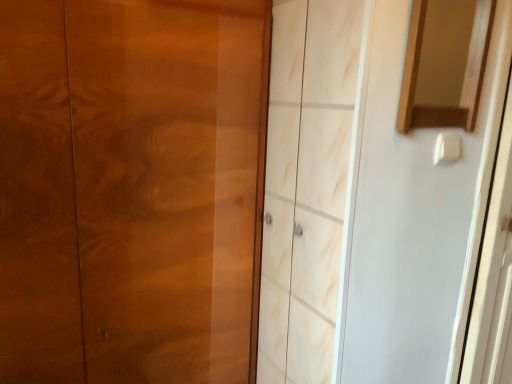
The image size is (512, 384). Describe the element at coordinates (463, 78) in the screenshot. I see `wooden mirror at upper right` at that location.

Measure the distance between wooden mirror at upper right and camera.

88.15 centimeters.

In order to face glossy wood door at left, should I rotate leftwards or rightwards?

It's best to rotate left around 15.903 degrees.

Find the location of a particular element. glossy wood door at left is located at coordinates (129, 189).

Where is `wooden mirror at upper right`? wooden mirror at upper right is located at coordinates (463, 78).

Locate an element on the screen. The width and height of the screenshot is (512, 384). screen door that is behind the wooden mirror at upper right is located at coordinates point(493,271).

Is white glossy screen door at right not near wooden mirror at upper right?

No.

Which is behind, point (481, 315) or point (411, 60)?

The point (481, 315) is farther.

Choose the correct answer: Is white glossy screen door at right inside wooden mirror at upper right or outside it?

The correct answer is: outside.

What's the angular difference between wooden mirror at upper right and white glossy screen door at right's facing directions?

They differ by 1.94 degrees in their facing directions.

Are wooden mirror at upper right and white glossy screen door at right beside each other?

No, wooden mirror at upper right is not making contact with white glossy screen door at right.

Considering the relative sizes of wooden mirror at upper right and white glossy screen door at right in the image provided, is wooden mirror at upper right smaller than white glossy screen door at right?

Indeed, wooden mirror at upper right has a smaller size compared to white glossy screen door at right.

Is wooden mirror at upper right outside of white glossy screen door at right?

wooden mirror at upper right lies outside white glossy screen door at right's area.

Considering the points (21, 335) and (408, 91), which point is behind, point (21, 335) or point (408, 91)?

The point (21, 335) is farther.

From a real-world perspective, between glossy wood door at left and wooden mirror at upper right, who is vertically lower?

In real-world perspective, glossy wood door at left is lower.

From the image's perspective, which object appears higher, glossy wood door at left or wooden mirror at upper right?

From the image's view, wooden mirror at upper right is above.

From the image's perspective, is white glossy screen door at right below glossy wood door at left?

Yes, from the image's perspective, white glossy screen door at right is beneath glossy wood door at left.

Considering the positions of objects white glossy screen door at right and glossy wood door at left in the image provided, who is in front, white glossy screen door at right or glossy wood door at left?

glossy wood door at left.

Are white glossy screen door at right and glossy wood door at left far apart?

That's not correct — white glossy screen door at right is a little close to glossy wood door at left.

Is white glossy screen door at right bigger than glossy wood door at left?

Incorrect, white glossy screen door at right is not larger than glossy wood door at left.

Looking at this image, do you think wooden mirror at upper right is within glossy wood door at left, or outside of it?

The correct answer is: outside.

Between wooden mirror at upper right and glossy wood door at left, which one has smaller width?

With smaller width is wooden mirror at upper right.

Is wooden mirror at upper right far from glossy wood door at left?

No, wooden mirror at upper right is not far away from glossy wood door at left.

Who is smaller, wooden mirror at upper right or glossy wood door at left?

wooden mirror at upper right.

Between glossy wood door at left and white glossy screen door at right, which one is positioned in front?

glossy wood door at left is in front.

Considering the positions of points (12, 63) and (494, 235), is point (12, 63) farther from camera compared to point (494, 235)?

No, (12, 63) is closer to viewer.

Which is more to the right, glossy wood door at left or white glossy screen door at right?

From the viewer's perspective, white glossy screen door at right appears more on the right side.

Where is `screen door below the glossy wood door at left (from the image's perspective)`? The image size is (512, 384). screen door below the glossy wood door at left (from the image's perspective) is located at coordinates (493, 271).

Find the location of a particular element. mirror in front of the white glossy screen door at right is located at coordinates (463, 78).

At what (x,y) coordinates should I click in order to perform the action: click on mirror on the left of white glossy screen door at right. Please return your answer as a coordinate pair (x, y). The image size is (512, 384). Looking at the image, I should click on (463, 78).

Consider the image. Looking at the image, which one is located further to wooden mirror at upper right, white glossy screen door at right or glossy wood door at left?

glossy wood door at left.

From the image, which object appears to be farther from glossy wood door at left, white glossy screen door at right or wooden mirror at upper right?

white glossy screen door at right is positioned further to the anchor glossy wood door at left.

From the picture: Looking at the image, which one is located further to glossy wood door at left, wooden mirror at upper right or white glossy screen door at right?

Among the two, white glossy screen door at right is located further to glossy wood door at left.

When comparing their distances from white glossy screen door at right, does glossy wood door at left or wooden mirror at upper right seem further?

glossy wood door at left is positioned further to the anchor white glossy screen door at right.

Which object lies nearer to the anchor point white glossy screen door at right, wooden mirror at upper right or glossy wood door at left?

wooden mirror at upper right is closer to white glossy screen door at right.

In the scene shown: Considering their positions, is glossy wood door at left positioned closer to wooden mirror at upper right than white glossy screen door at right?

Based on the image, white glossy screen door at right appears to be nearer to wooden mirror at upper right.

This screenshot has width=512, height=384. Identify the location of mirror situated between glossy wood door at left and white glossy screen door at right from left to right. (463, 78).